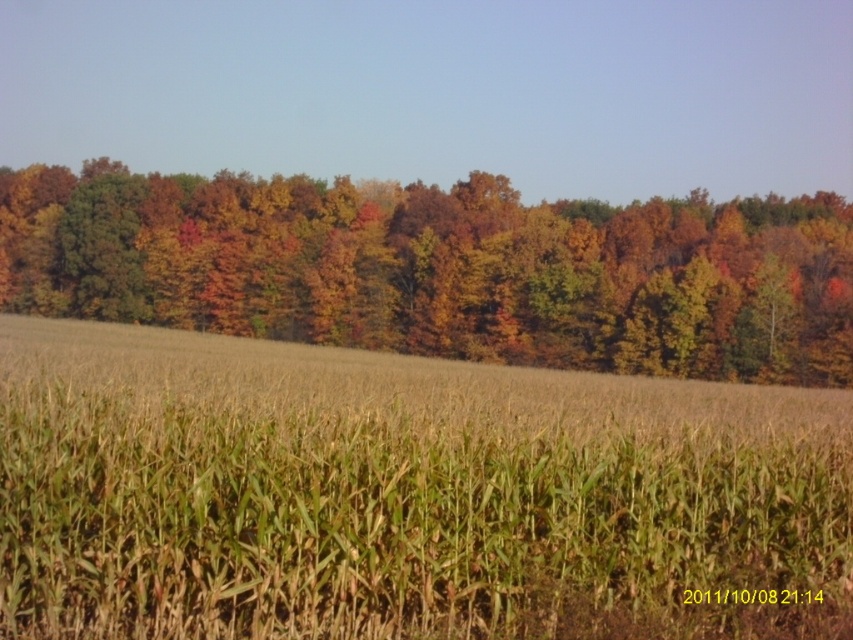
Can you confirm if green matte wheat field at center is shorter than autumn leaves at center?

Yes, green matte wheat field at center is shorter than autumn leaves at center.

At what (x,y) coordinates should I click in order to perform the action: click on green matte wheat field at center. Please return your answer as a coordinate pair (x, y). Looking at the image, I should click on (404, 496).